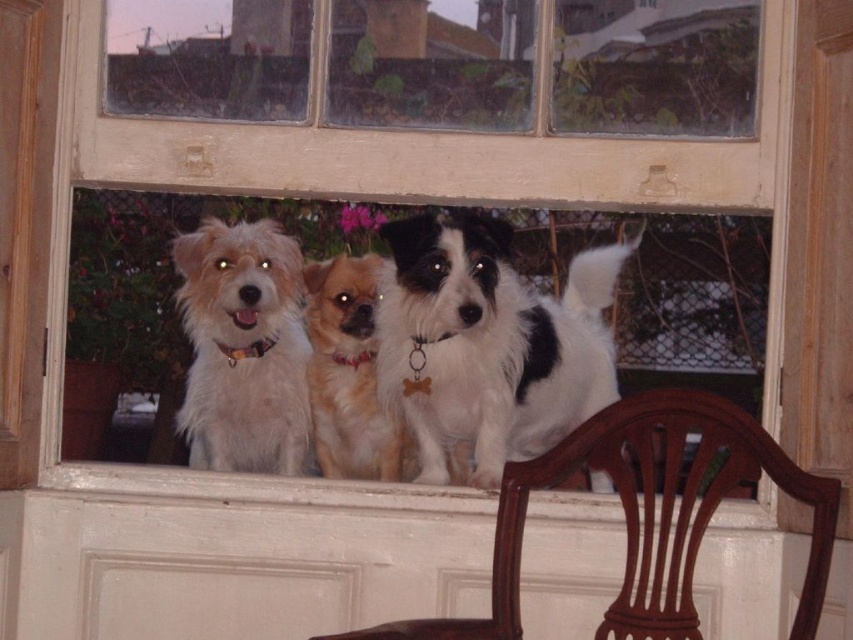
You are sitting in the mahogany wood chair at lower center and want to pet the white fluffy dog at center. Can you reach the dog without moving from your seat?

The mahogany wood chair at lower center is in front of the white fluffy dog at center, so you can reach the dog without moving from your seat.

You are a photographer trying to capture a photo of the black and white fur at center and the golden brown fur at center through the window. Which dog is more to the right side?

The black and white fur at center is positioned on the right side of golden brown fur at center, so the black and white fur at center is more to the right side.